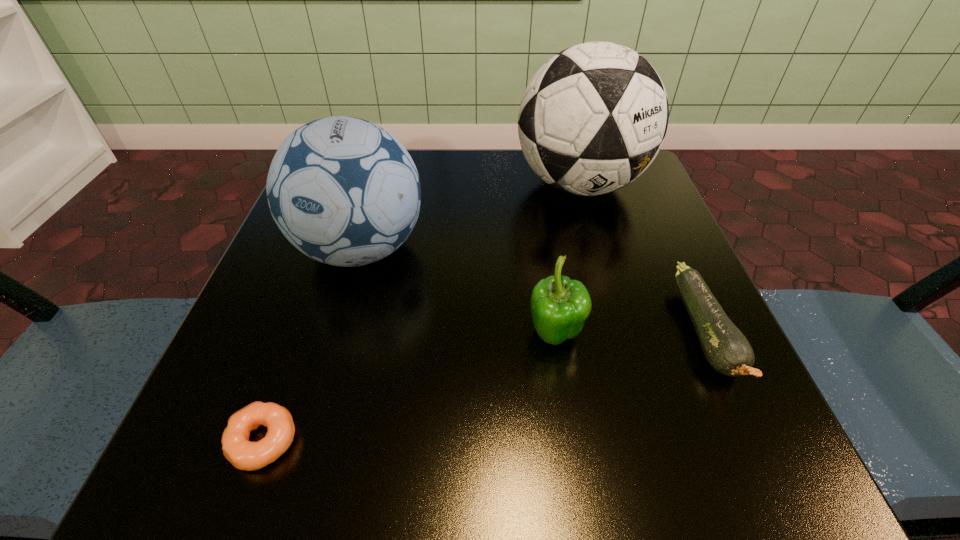
Where is `blank area at the left edge`? The height and width of the screenshot is (540, 960). blank area at the left edge is located at coordinates (342, 322).

Find the location of a particular element. The image size is (960, 540). free region at the right edge of the desktop is located at coordinates pos(670,329).

What are the coordinates of `vacant space at the near right corner of the desktop` in the screenshot? It's located at (716, 446).

The width and height of the screenshot is (960, 540). Find the location of `free spot between the fourth shortest object and the right soccer ball`. free spot between the fourth shortest object and the right soccer ball is located at coordinates (470, 217).

Identify the location of vacant space that is in between the nearest object and the second shortest object. (484, 386).

I want to click on vacant region between the fourth shortest object and the bell pepper, so click(x=458, y=292).

Locate an element on the screen. This screenshot has height=540, width=960. free spot between the second tallest object and the third shortest object is located at coordinates (458, 292).

You are a GUI agent. You are given a task and a screenshot of the screen. Output one action in this format:
    pyautogui.click(x=<x>, y=<y>)
    Task: Click on the empty location between the third shortest object and the right soccer ball
    The image size is (960, 540).
    Given the screenshot: What is the action you would take?
    pyautogui.click(x=566, y=260)

The width and height of the screenshot is (960, 540). Find the location of `vacant area that lies between the shorter soccer ball and the right soccer ball`. vacant area that lies between the shorter soccer ball and the right soccer ball is located at coordinates (470, 217).

You are a GUI agent. You are given a task and a screenshot of the screen. Output one action in this format:
    pyautogui.click(x=<x>, y=<y>)
    Task: Click on the free spot between the right soccer ball and the second shortest object
    
    Given the screenshot: What is the action you would take?
    pyautogui.click(x=642, y=258)